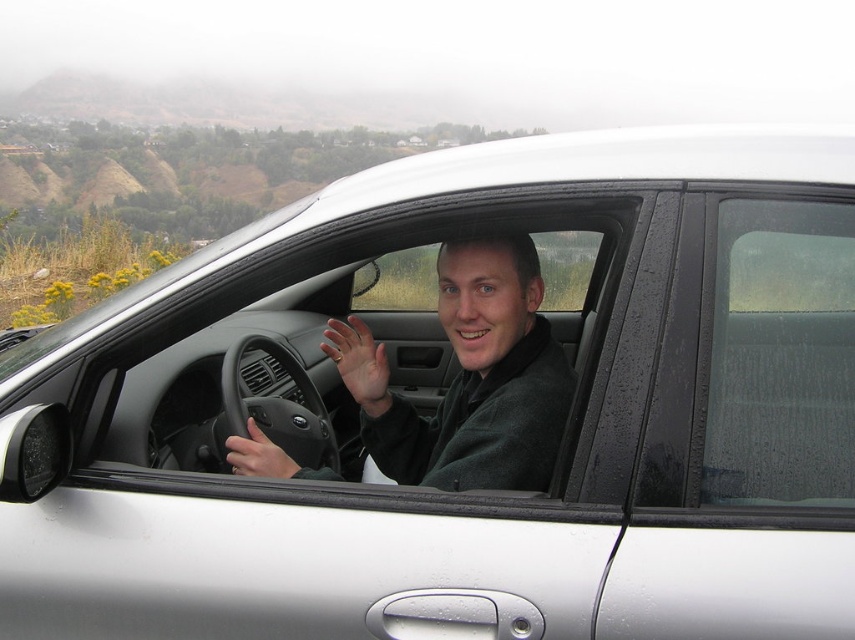
Question: Among these points, which one is nearest to the camera?

Choices:
 (A) (799, 481)
 (B) (492, 401)
 (C) (358, 396)

Answer: (A)

Question: Estimate the real-world distances between objects in this image. Which object is closer to the dark gray fleece jacket at center?

Choices:
 (A) wet glass window at center right
 (B) matte skin hand at center
 (C) matte black steering wheel at center

Answer: (B)

Question: Can you confirm if dark gray fleece jacket at center is positioned to the left of matte black steering wheel at center?

Choices:
 (A) no
 (B) yes

Answer: (A)

Question: Is wet glass window at center right thinner than dark gray fleece jacket at center?

Choices:
 (A) yes
 (B) no

Answer: (A)

Question: In this image, where is matte skin hand at center located relative to matte black steering wheel at center?

Choices:
 (A) left
 (B) right

Answer: (B)

Question: Among these objects, which one is nearest to the camera?

Choices:
 (A) dark gray fleece jacket at center
 (B) wet glass window at center right
 (C) matte black steering wheel at center
 (D) matte skin hand at center

Answer: (B)